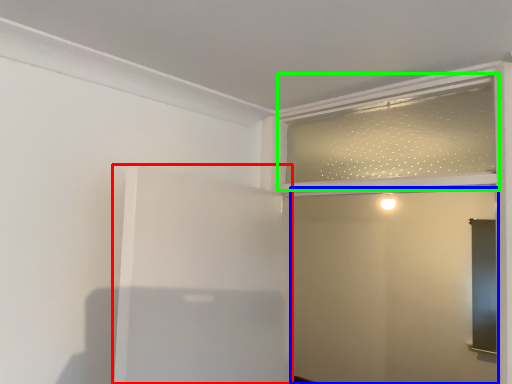
Question: Which object is positioned farthest from elevator (highlighted by a red box)? Select from screen door (highlighted by a blue box) and window frame (highlighted by a green box).

Choices:
 (A) screen door
 (B) window frame

Answer: (A)